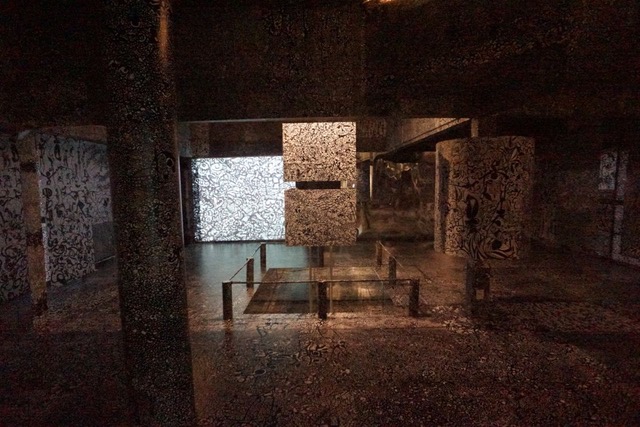
This screenshot has height=427, width=640. Identify the location of support column. (40, 258).